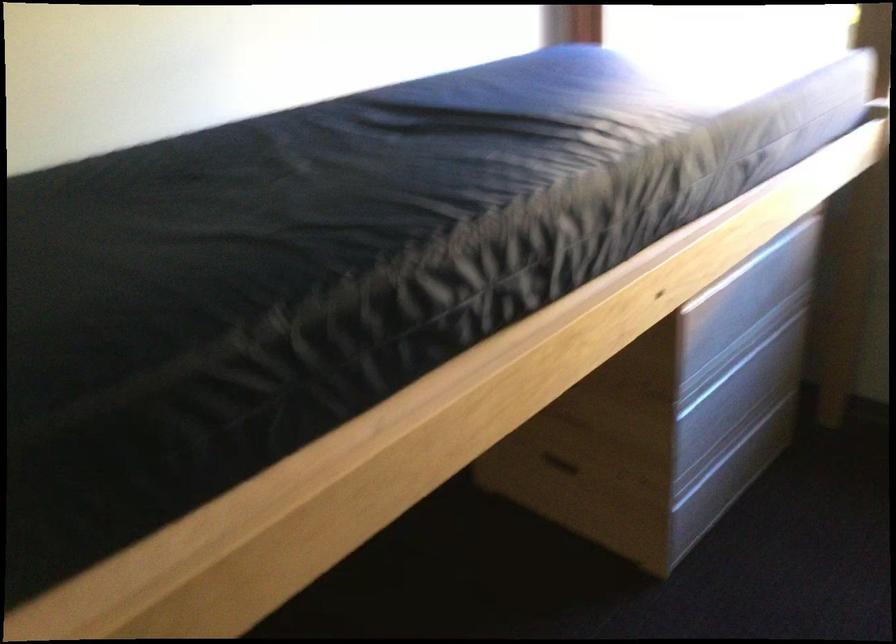
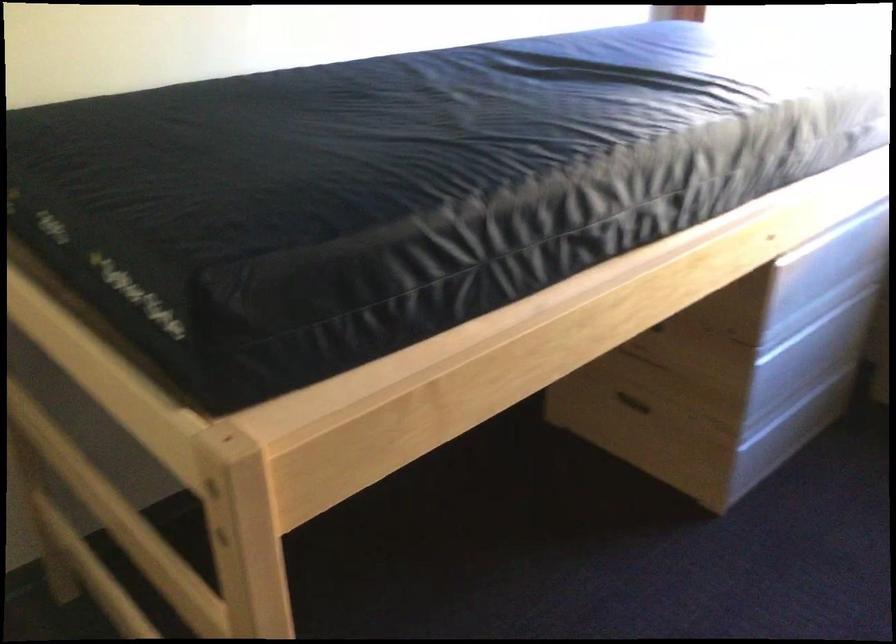
Consider the image. What movement of the cameraman would produce the second image?

The cameraman moved toward left, backward.